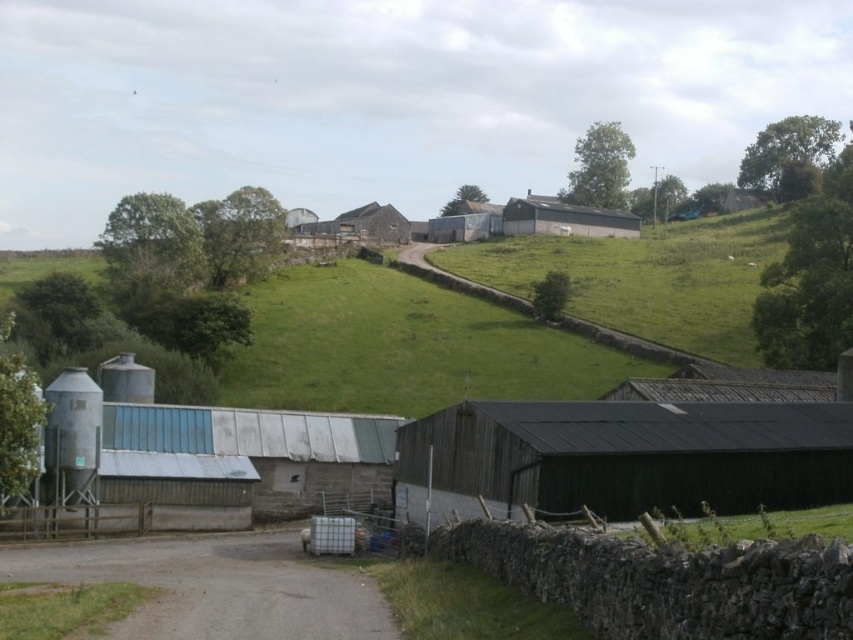
Question: Which point is closer to the camera?

Choices:
 (A) (291, 561)
 (B) (657, 404)
 (C) (762, 216)

Answer: (A)

Question: Which object is closer to the camera taking this photo?

Choices:
 (A) metallic corrugated barn at center
 (B) dark green corrugated metal barn at center-right
 (C) green grassy hillside at upper center
 (D) metallic silo at left

Answer: (B)

Question: Can you confirm if dark green corrugated metal barn at center-right is positioned to the right of green grassy hillside at upper center?

Choices:
 (A) no
 (B) yes

Answer: (A)

Question: Is gray gravel road at lower left closer to the viewer compared to metallic silo at left?

Choices:
 (A) no
 (B) yes

Answer: (B)

Question: Which point is closer to the camera?

Choices:
 (A) (263, 634)
 (B) (64, 465)

Answer: (A)

Question: Is green grassy hillside at upper center below metallic corrugated barn at center?

Choices:
 (A) no
 (B) yes

Answer: (B)